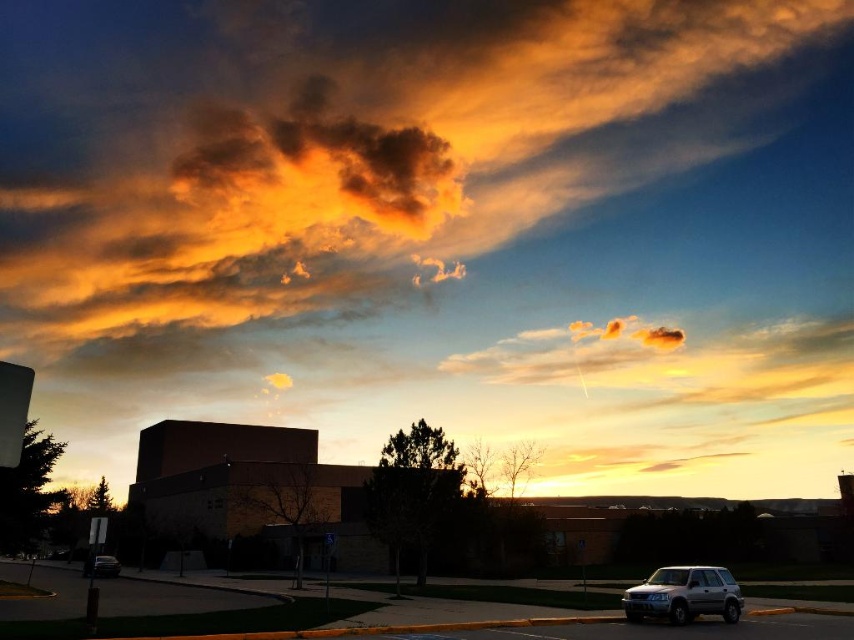
In the scene shown: Is golden-orange cotton candy at upper center thinner than satin silver suv at lower left?

Incorrect, golden-orange cotton candy at upper center's width is not less than satin silver suv at lower left's.

Which is above, golden-orange cotton candy at upper center or satin silver suv at lower left?

Positioned higher is golden-orange cotton candy at upper center.

Is point (313, 84) positioned in front of point (102, 577)?

No, (313, 84) is further to viewer.

Where is `golden-orange cotton candy at upper center`? golden-orange cotton candy at upper center is located at coordinates click(x=385, y=152).

Find the location of a particular element. golden-orange cotton candy at upper center is located at coordinates (385, 152).

Can you confirm if golden-orange cotton candy at upper center is taller than silver metallic suv at lower right?

Indeed, golden-orange cotton candy at upper center has a greater height compared to silver metallic suv at lower right.

At what (x,y) coordinates should I click in order to perform the action: click on golden-orange cotton candy at upper center. Please return your answer as a coordinate pair (x, y). This screenshot has height=640, width=854. Looking at the image, I should click on (385, 152).

Is silver metallic suv at lower right thinner than satin silver suv at lower left?

Yes.

Who is more distant from viewer, (638, 595) or (95, 566)?

The point (95, 566) is more distant.

In order to click on silver metallic suv at lower right in this screenshot , I will do `click(683, 595)`.